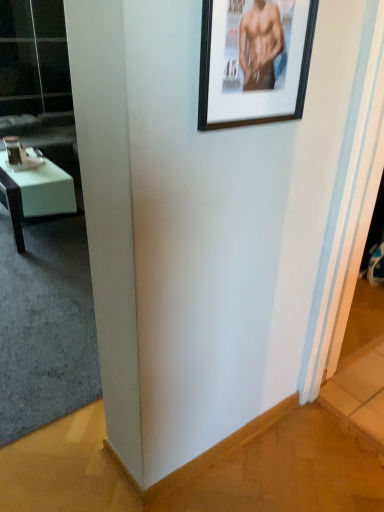
Question: From the image's perspective, is black matte picture frame at upper right below transparent glass door at upper left?

Choices:
 (A) yes
 (B) no

Answer: (A)

Question: Is the depth of black matte picture frame at upper right less than that of transparent glass door at upper left?

Choices:
 (A) no
 (B) yes

Answer: (B)

Question: From a real-world perspective, is black matte picture frame at upper right on transparent glass door at upper left?

Choices:
 (A) yes
 (B) no

Answer: (A)

Question: Does black matte picture frame at upper right appear on the right side of transparent glass door at upper left?

Choices:
 (A) yes
 (B) no

Answer: (A)

Question: Is black matte picture frame at upper right touching transparent glass door at upper left?

Choices:
 (A) yes
 (B) no

Answer: (B)

Question: Considering the relative positions of black matte picture frame at upper right and transparent glass door at upper left in the image provided, is black matte picture frame at upper right behind transparent glass door at upper left?

Choices:
 (A) no
 (B) yes

Answer: (A)

Question: Is white leather couch at left not within white glossy desk at left?

Choices:
 (A) no
 (B) yes

Answer: (B)

Question: Considering the relative sizes of white leather couch at left and white glossy desk at left in the image provided, is white leather couch at left wider than white glossy desk at left?

Choices:
 (A) yes
 (B) no

Answer: (A)

Question: From the image's perspective, is white leather couch at left below white glossy desk at left?

Choices:
 (A) yes
 (B) no

Answer: (B)

Question: Considering the relative sizes of white leather couch at left and white glossy desk at left in the image provided, is white leather couch at left shorter than white glossy desk at left?

Choices:
 (A) yes
 (B) no

Answer: (B)

Question: Is the depth of white leather couch at left less than that of white glossy desk at left?

Choices:
 (A) yes
 (B) no

Answer: (B)

Question: Is white glossy desk at left completely or partially inside white leather couch at left?

Choices:
 (A) no
 (B) yes

Answer: (A)

Question: Does transparent glass door at upper left have a lesser width compared to white glossy desk at left?

Choices:
 (A) yes
 (B) no

Answer: (A)